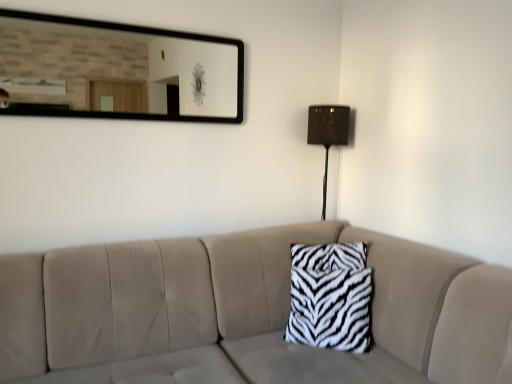
This screenshot has width=512, height=384. What do you see at coordinates (116, 71) in the screenshot? I see `black-framed mirror at upper center` at bounding box center [116, 71].

Find the location of a particular element. zebra-patterned fabric pillow at center is located at coordinates (330, 297).

Measure the distance from black-framed mirror at upper center to zebra-patterned fabric pillow at center.

black-framed mirror at upper center is 5.32 feet away from zebra-patterned fabric pillow at center.

From the picture: Can you confirm if black-framed mirror at upper center is positioned to the right of zebra-patterned fabric pillow at center?

In fact, black-framed mirror at upper center is to the left of zebra-patterned fabric pillow at center.

Is black-framed mirror at upper center positioned beyond the bounds of zebra-patterned fabric pillow at center?

Yes.

Does point (146, 29) appear closer or farther from the camera than point (324, 277)?

Point (146, 29).

The height and width of the screenshot is (384, 512). What are the coordinates of `table lamp below the black-framed mirror at upper center (from a real-world perspective)` in the screenshot? It's located at (328, 133).

From the image's perspective, is black-framed mirror at upper center located beneath matte brown table lamp at right?

Incorrect, from the image's perspective, black-framed mirror at upper center is higher than matte brown table lamp at right.

Which is behind, point (132, 110) or point (309, 132)?

Positioned behind is point (132, 110).

Is zebra-patterned fabric pillow at center further to the viewer compared to matte brown table lamp at right?

No, it is in front of matte brown table lamp at right.

Is point (321, 257) farther from viewer compared to point (342, 108)?

No, it is in front of (342, 108).

Is zebra-patterned fabric pillow at center smaller than matte brown table lamp at right?

Actually, zebra-patterned fabric pillow at center might be larger than matte brown table lamp at right.

From a real-world perspective, is zebra-patterned fabric pillow at center physically located above or below matte brown table lamp at right?

zebra-patterned fabric pillow at center is situated lower than matte brown table lamp at right in the real world.

Would you consider zebra-patterned fabric pillow at center to be distant from black-framed mirror at upper center?

That's right, there is a large distance between zebra-patterned fabric pillow at center and black-framed mirror at upper center.

Which is closer, (365,254) or (50,90)?

Point (365,254) is farther from the camera than point (50,90).

Which object is wider, zebra-patterned fabric pillow at center or black-framed mirror at upper center?

zebra-patterned fabric pillow at center.

Would you say zebra-patterned fabric pillow at center is to the left or to the right of black-framed mirror at upper center in the picture?

In the image, zebra-patterned fabric pillow at center appears on the right side of black-framed mirror at upper center.

From a real-world perspective, who is located lower, matte brown table lamp at right or white zebra-patterned pillow at center?

From a 3D spatial view, white zebra-patterned pillow at center is below.

Is matte brown table lamp at right shorter than white zebra-patterned pillow at center?

Correct, matte brown table lamp at right is not as tall as white zebra-patterned pillow at center.

Does point (312, 107) lie behind point (412, 374)?

Yes, it is behind point (412, 374).

Is zebra-patterned fabric pillow at center situated inside white zebra-patterned pillow at center or outside?

zebra-patterned fabric pillow at center exists entirely within white zebra-patterned pillow at center.

Is zebra-patterned fabric pillow at center taller than white zebra-patterned pillow at center?

Incorrect, the height of zebra-patterned fabric pillow at center is not larger of that of white zebra-patterned pillow at center.

In terms of width, does zebra-patterned fabric pillow at center look wider or thinner when compared to white zebra-patterned pillow at center?

zebra-patterned fabric pillow at center is thinner than white zebra-patterned pillow at center.

From the image's perspective, which is below, zebra-patterned fabric pillow at center or white zebra-patterned pillow at center?

white zebra-patterned pillow at center.

From the image's perspective, is matte brown table lamp at right positioned above or below zebra-patterned fabric pillow at center?

Clearly, from the image's perspective, matte brown table lamp at right is above zebra-patterned fabric pillow at center.

Measure the distance between matte brown table lamp at right and zebra-patterned fabric pillow at center.

matte brown table lamp at right is 31.15 inches from zebra-patterned fabric pillow at center.

Does point (315, 109) come farther from viewer compared to point (341, 275)?

That is True.

Is matte brown table lamp at right to the left or to the right of zebra-patterned fabric pillow at center in the image?

Based on their positions, matte brown table lamp at right is located to the right of zebra-patterned fabric pillow at center.

Identify the location of mirror above the zebra-patterned fabric pillow at center (from a real-world perspective). The width and height of the screenshot is (512, 384). (116, 71).

The image size is (512, 384). I want to click on table lamp on the right of the black-framed mirror at upper center, so click(328, 133).

Considering their positions, is black-framed mirror at upper center positioned further to matte brown table lamp at right than white zebra-patterned pillow at center?

black-framed mirror at upper center is positioned further to the anchor matte brown table lamp at right.

When comparing their distances from black-framed mirror at upper center, does zebra-patterned fabric pillow at center or white zebra-patterned pillow at center seem further?

Among the two, white zebra-patterned pillow at center is located further to black-framed mirror at upper center.

Based on their spatial positions, is black-framed mirror at upper center or zebra-patterned fabric pillow at center closer to matte brown table lamp at right?

The object closer to matte brown table lamp at right is zebra-patterned fabric pillow at center.

Considering their positions, is matte brown table lamp at right positioned further to zebra-patterned fabric pillow at center than white zebra-patterned pillow at center?

matte brown table lamp at right.

Which object lies nearer to the anchor point black-framed mirror at upper center, white zebra-patterned pillow at center or matte brown table lamp at right?

matte brown table lamp at right.

Based on their spatial positions, is black-framed mirror at upper center or matte brown table lamp at right further from zebra-patterned fabric pillow at center?

The object further to zebra-patterned fabric pillow at center is black-framed mirror at upper center.

Looking at the image, which one is located closer to matte brown table lamp at right, white zebra-patterned pillow at center or zebra-patterned fabric pillow at center?

zebra-patterned fabric pillow at center.

Which object lies further to the anchor point black-framed mirror at upper center, matte brown table lamp at right or white zebra-patterned pillow at center?

Based on the image, white zebra-patterned pillow at center appears to be further to black-framed mirror at upper center.

Locate an element on the screen. The width and height of the screenshot is (512, 384). pillow between black-framed mirror at upper center and white zebra-patterned pillow at center from top to bottom is located at coordinates [330, 297].

This screenshot has height=384, width=512. Identify the location of pillow between black-framed mirror at upper center and matte brown table lamp at right from left to right. (330, 297).

Find the location of a particular element. The height and width of the screenshot is (384, 512). pillow between white zebra-patterned pillow at center and matte brown table lamp at right in the front-back direction is located at coordinates (330, 297).

This screenshot has width=512, height=384. Identify the location of mirror located between white zebra-patterned pillow at center and matte brown table lamp at right in the depth direction. (116, 71).